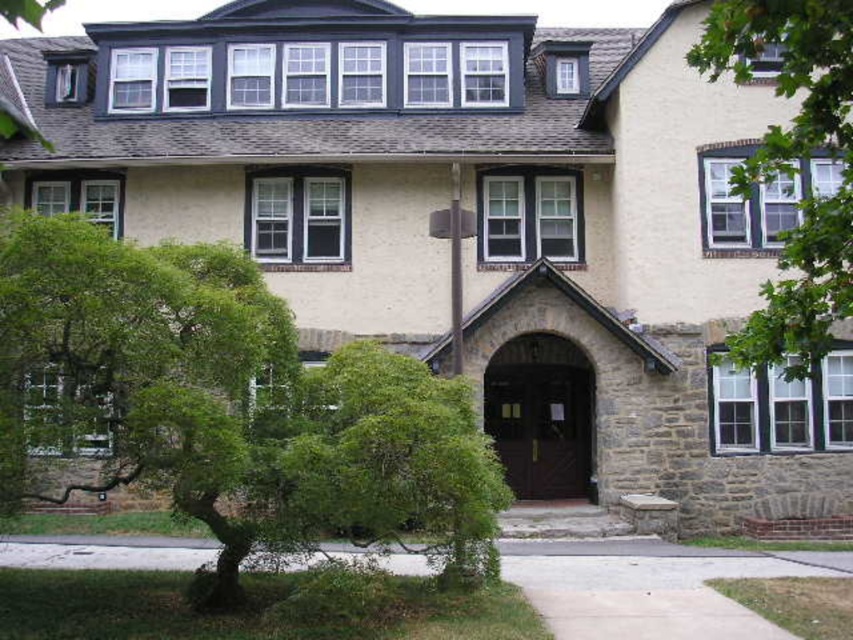
Question: Is green leafy tree at left thinner than green leafy tree at upper right?

Choices:
 (A) yes
 (B) no

Answer: (A)

Question: Is green leafy tree at left smaller than green leafy tree at upper right?

Choices:
 (A) no
 (B) yes

Answer: (B)

Question: Which point appears farthest from the camera in this image?

Choices:
 (A) (752, 365)
 (B) (256, 385)

Answer: (B)

Question: Which object appears closest to the camera in this image?

Choices:
 (A) green leafy tree at left
 (B) green leafy tree at upper right

Answer: (B)

Question: Can you confirm if green leafy tree at left is positioned to the right of green leafy tree at upper right?

Choices:
 (A) yes
 (B) no

Answer: (B)